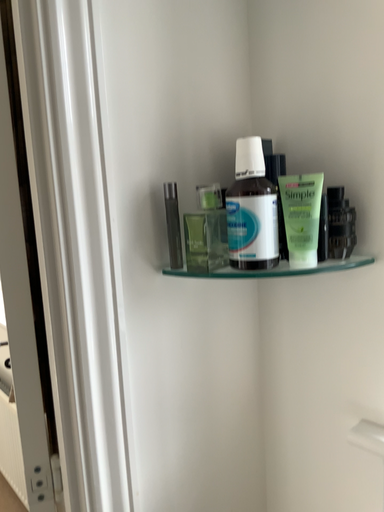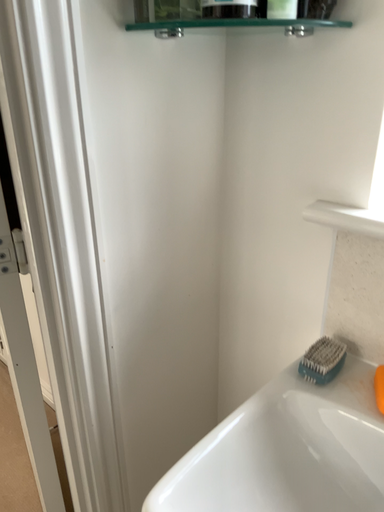
Question: Which way did the camera rotate in the video?

Choices:
 (A) rotated downward
 (B) rotated upward

Answer: (A)